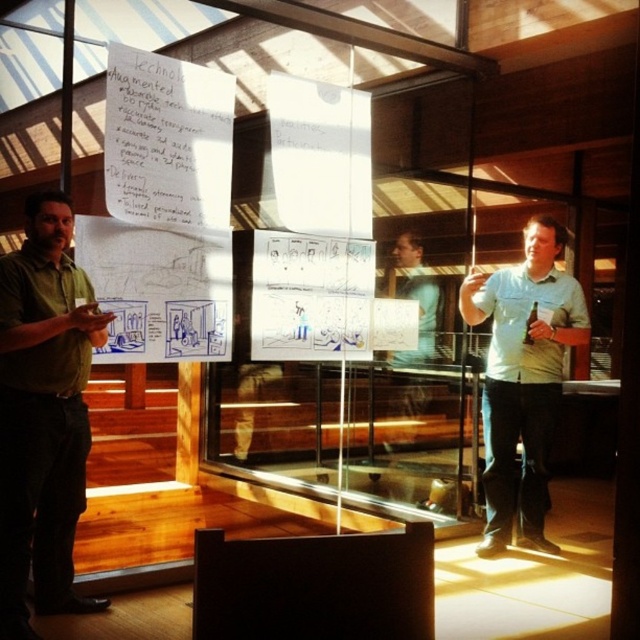
Is green matte shirt at left thinner than white shirt at right?

Indeed, green matte shirt at left has a lesser width compared to white shirt at right.

Is green matte shirt at left wider than white shirt at right?

No.

Is point (26, 460) positioned after point (492, 292)?

No.

You are a GUI agent. You are given a task and a screenshot of the screen. Output one action in this format:
    pyautogui.click(x=<x>, y=<y>)
    Task: Click on the green matte shirt at left
    Image resolution: width=640 pixels, height=640 pixels.
    Given the screenshot: What is the action you would take?
    pyautogui.click(x=44, y=416)